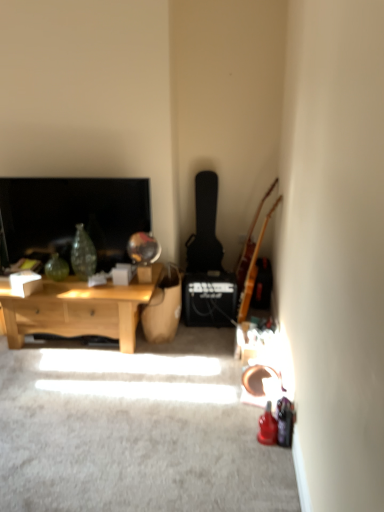
Question: Considering the positions of point (46, 240) and point (74, 298), is point (46, 240) closer or farther from the camera than point (74, 298)?

Choices:
 (A) farther
 (B) closer

Answer: (A)

Question: Is matte black television at left wider or thinner than light wood coffee table at left?

Choices:
 (A) wide
 (B) thin

Answer: (B)

Question: Estimate the real-world distances between objects in this image. Which object is closer to the black matte guitar at center-right, the 1th guitar when ordered from left to right?

Choices:
 (A) matte black television at left
 (B) light wood coffee table at left
 (C) light brown wooden guitar at right, which appears as the second guitar when viewed from the left

Answer: (C)

Question: Which object is positioned farthest from the black matte guitar at center-right, the 1th guitar when ordered from left to right?

Choices:
 (A) light wood coffee table at left
 (B) light brown wooden guitar at right, which appears as the 1th guitar when viewed from the right
 (C) matte black television at left

Answer: (A)